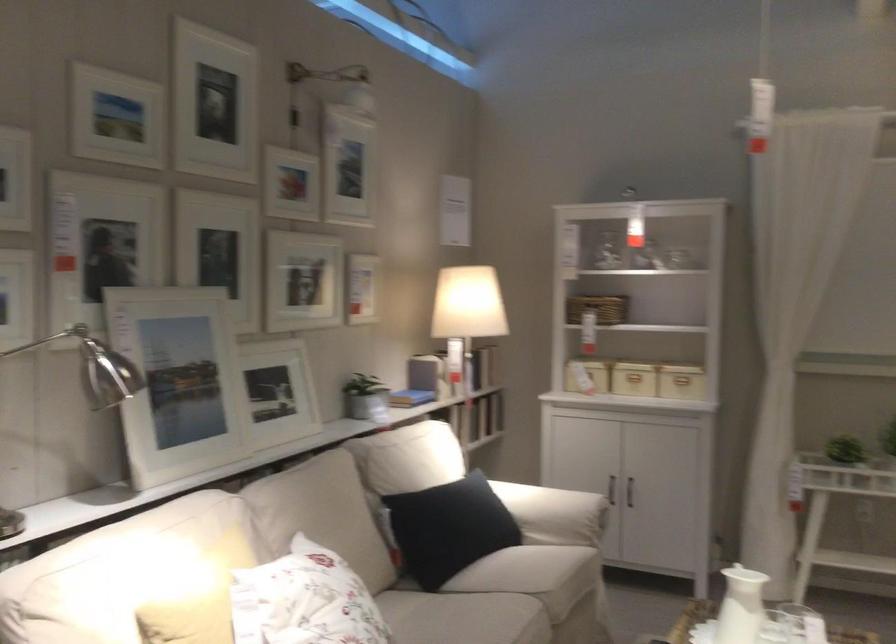
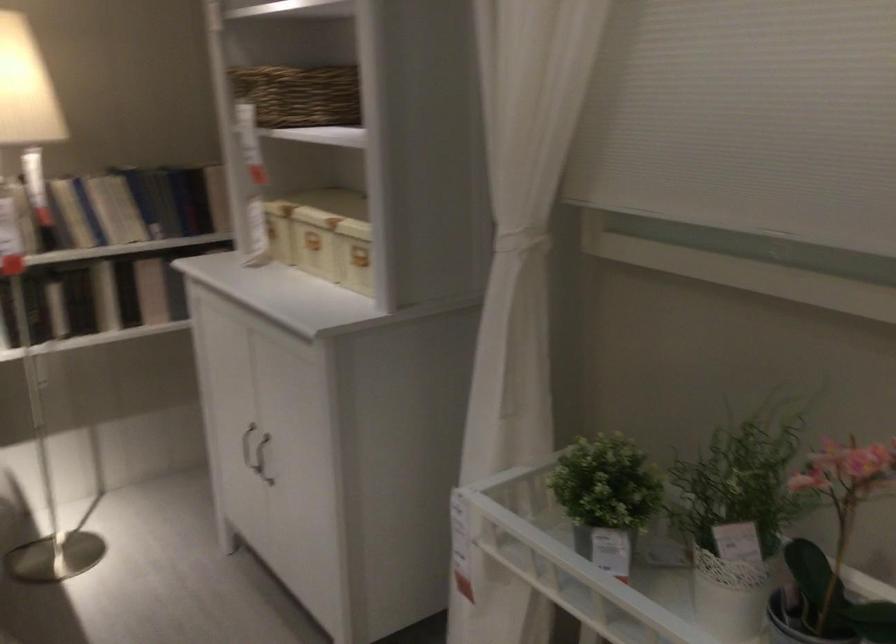
Find the pixel in the second image that matches [694,366] in the first image.

(354, 254)